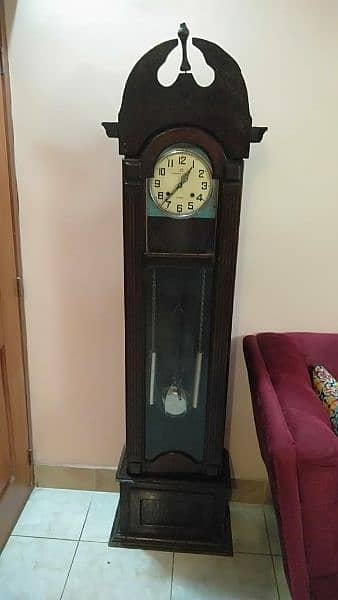
You are a GUI agent. You are given a task and a screenshot of the screen. Output one action in this format:
    pyautogui.click(x=<x>, y=<y>)
    Task: Click on the tile
    The width and height of the screenshot is (338, 600).
    Given the screenshot: What is the action you would take?
    pyautogui.click(x=88, y=576)